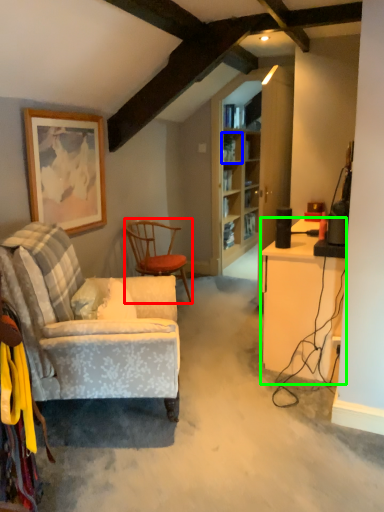
Question: Which is nearer to the chair (highlighted by a red box)? shelf (highlighted by a blue box) or desk (highlighted by a green box).

Choices:
 (A) shelf
 (B) desk

Answer: (B)